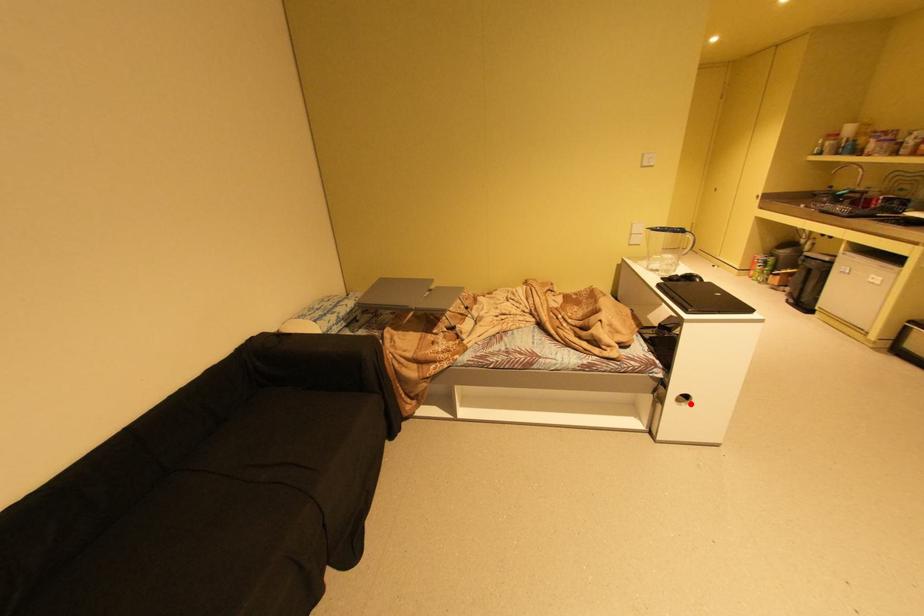
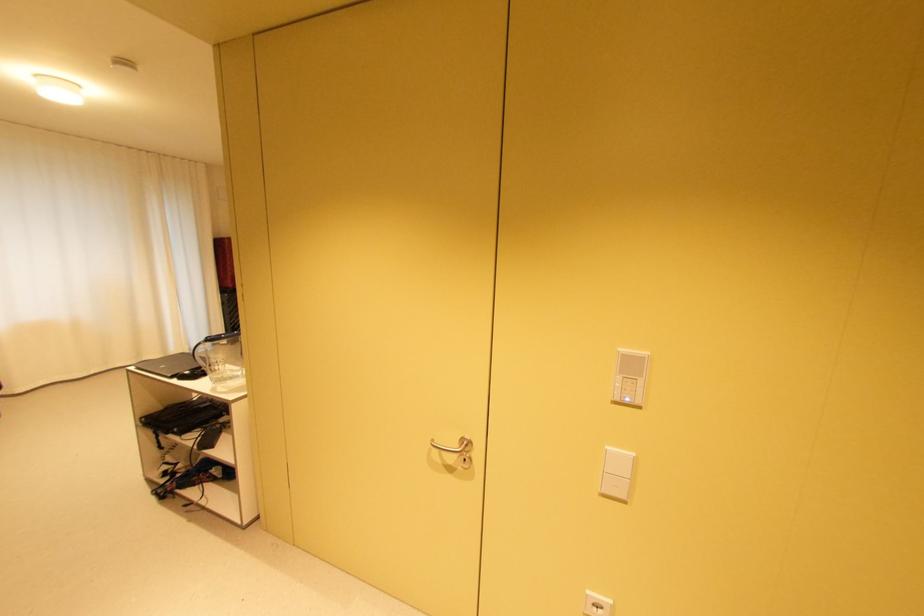
Question: I am providing you with two images of the same scene from different viewpoints. A red point is marked on the first image. Is the red point's position out of view in image 2?

Choices:
 (A) Yes
 (B) No

Answer: (A)